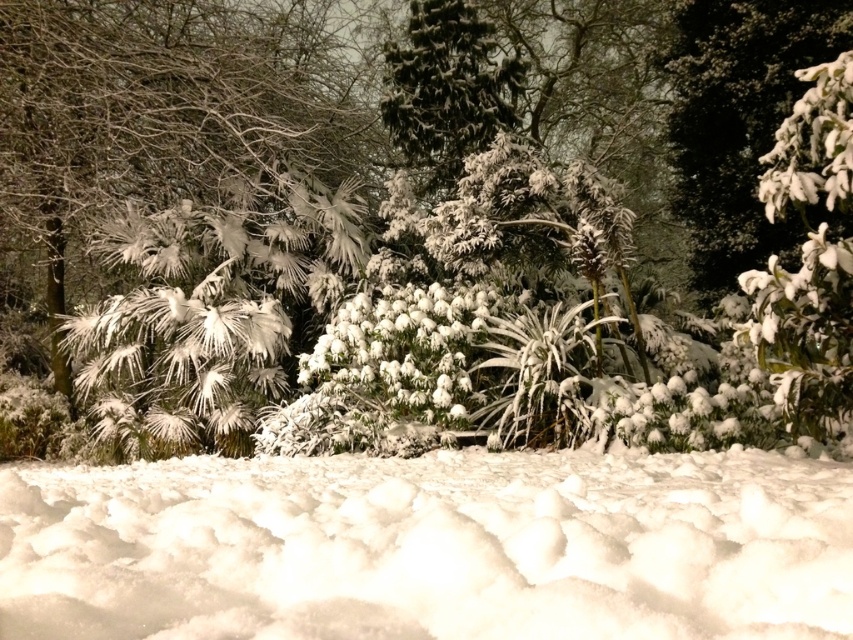
Does white fluffy snow at lower center have a smaller size compared to white fluffy snow at upper right?

Yes.

This screenshot has width=853, height=640. What do you see at coordinates (430, 547) in the screenshot?
I see `white fluffy snow at lower center` at bounding box center [430, 547].

What do you see at coordinates (430, 547) in the screenshot? Image resolution: width=853 pixels, height=640 pixels. I see `white fluffy snow at lower center` at bounding box center [430, 547].

The height and width of the screenshot is (640, 853). I want to click on white fluffy snow at lower center, so click(430, 547).